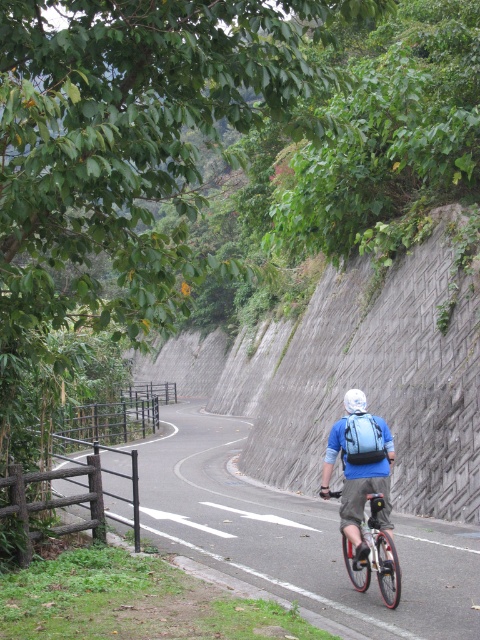
Question: Which of the following is the farthest from the observer?

Choices:
 (A) (230, 570)
 (B) (352, 388)
 (C) (364, 525)
 (D) (363, 541)

Answer: (B)

Question: Which of the following is the farthest from the observer?

Choices:
 (A) blue fabric backpack at center
 (B) white matte bicycle helmet at center

Answer: (B)

Question: Can you confirm if asphalt road at center is thinner than blue fabric backpack at center?

Choices:
 (A) no
 (B) yes

Answer: (A)

Question: In this image, where is blue fabric backpack at center located relative to metallic silver bicycle at center?

Choices:
 (A) below
 (B) above

Answer: (B)

Question: Which of these objects is positioned farthest from the asphalt road at center?

Choices:
 (A) metallic silver bicycle at center
 (B) blue fabric backpack at center
 (C) white matte bicycle helmet at center

Answer: (C)

Question: Can you confirm if asphalt road at center is wider than blue fabric backpack at center?

Choices:
 (A) yes
 (B) no

Answer: (A)